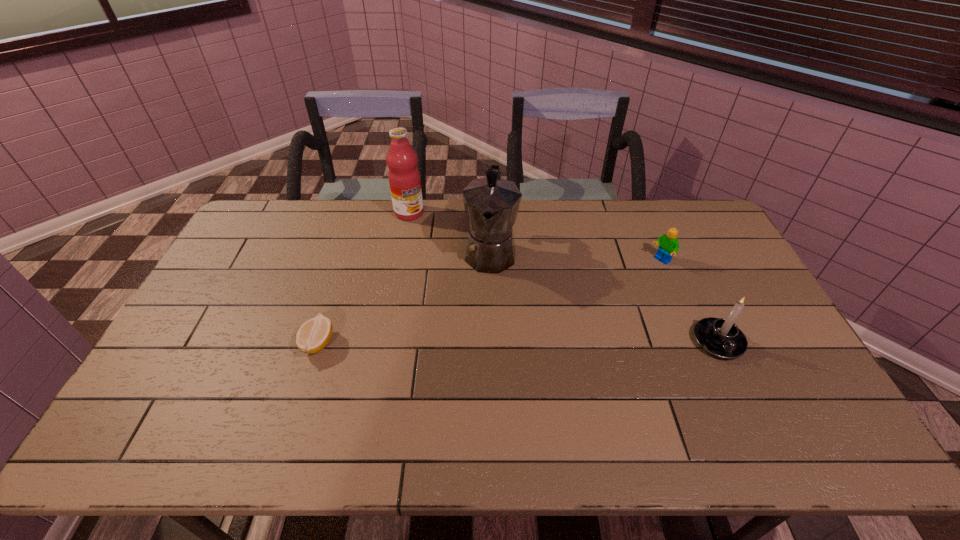
Where is `object that is at the right edge`? This screenshot has width=960, height=540. object that is at the right edge is located at coordinates (720, 337).

Where is `vacant space at the far edge of the desktop`? The image size is (960, 540). vacant space at the far edge of the desktop is located at coordinates (554, 199).

This screenshot has height=540, width=960. I want to click on vacant area at the near edge of the desktop, so click(313, 401).

You are a GUI agent. You are given a task and a screenshot of the screen. Output one action in this format:
    pyautogui.click(x=<x>, y=<y>)
    Task: Click on the vacant space at the left edge of the desktop
    This screenshot has width=960, height=540.
    Given the screenshot: What is the action you would take?
    pyautogui.click(x=250, y=267)

Locate an element on the screen. free space at the far left corner of the desktop is located at coordinates (284, 200).

I want to click on free region at the far right corner of the desktop, so click(x=687, y=212).

The height and width of the screenshot is (540, 960). What are the coordinates of `free region at the near right corner` in the screenshot? It's located at (761, 393).

What are the coordinates of `empty space that is in between the shortest object and the fruit juice` in the screenshot? It's located at (364, 278).

Where is `free space between the Lego and the third object from left to right`? This screenshot has width=960, height=540. free space between the Lego and the third object from left to right is located at coordinates (575, 256).

Identify the location of free spot between the coffeepot and the second object from left to right. (449, 232).